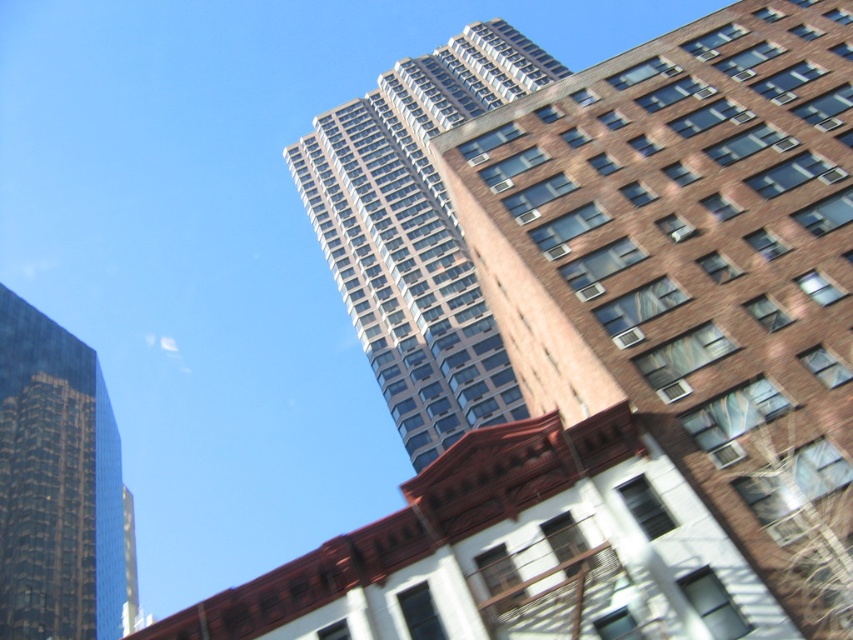
Question: Which point is closer to the camera?

Choices:
 (A) coord(105,524)
 (B) coord(375,156)

Answer: (A)

Question: Is glassy concrete skyscraper at center thinner than shiny glass skyscraper at left?

Choices:
 (A) yes
 (B) no

Answer: (B)

Question: Is brown brick building at upper center further to the viewer compared to shiny glass skyscraper at left?

Choices:
 (A) yes
 (B) no

Answer: (B)

Question: Estimate the real-world distances between objects in this image. Which object is closer to the shiny glass skyscraper at left?

Choices:
 (A) brown brick building at upper center
 (B) glassy concrete skyscraper at center

Answer: (B)

Question: Is brown brick building at upper center further to the viewer compared to glassy concrete skyscraper at center?

Choices:
 (A) no
 (B) yes

Answer: (A)

Question: Which object is positioned farthest from the shiny glass skyscraper at left?

Choices:
 (A) glassy concrete skyscraper at center
 (B) brown brick building at upper center

Answer: (B)